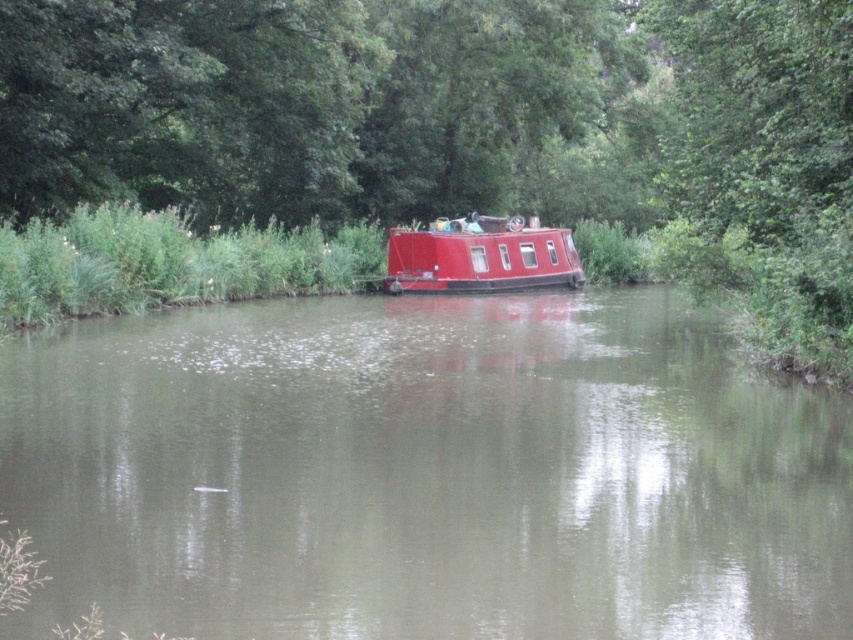
Question: Is smooth brown water at center to the left of shiny red boat at center from the viewer's perspective?

Choices:
 (A) no
 (B) yes

Answer: (B)

Question: Among these points, which one is farthest from the camera?

Choices:
 (A) (387, 252)
 (B) (311, 324)

Answer: (A)

Question: Can you confirm if smooth brown water at center is smaller than shiny red boat at center?

Choices:
 (A) no
 (B) yes

Answer: (A)

Question: Which of the following is the closest to the observer?

Choices:
 (A) smooth brown water at center
 (B) shiny red boat at center

Answer: (A)

Question: Does smooth brown water at center appear over shiny red boat at center?

Choices:
 (A) yes
 (B) no

Answer: (B)